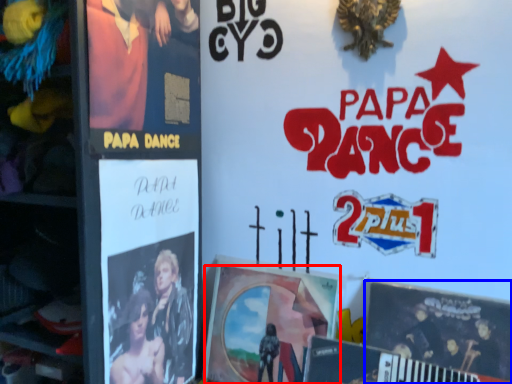
Question: Which object appears farthest to the camera in this image, poster (highlighted by a red box) or poster (highlighted by a blue box)?

Choices:
 (A) poster
 (B) poster

Answer: (A)